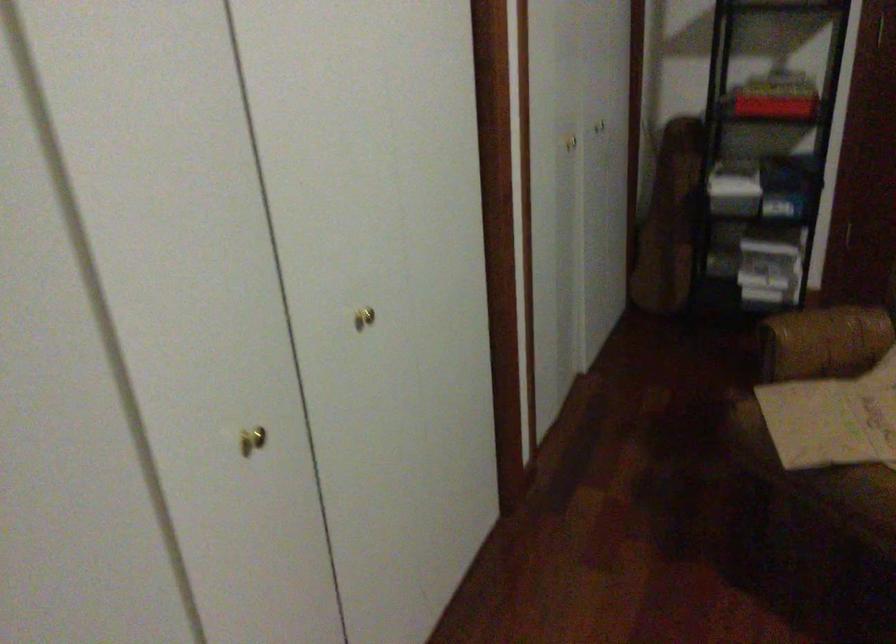
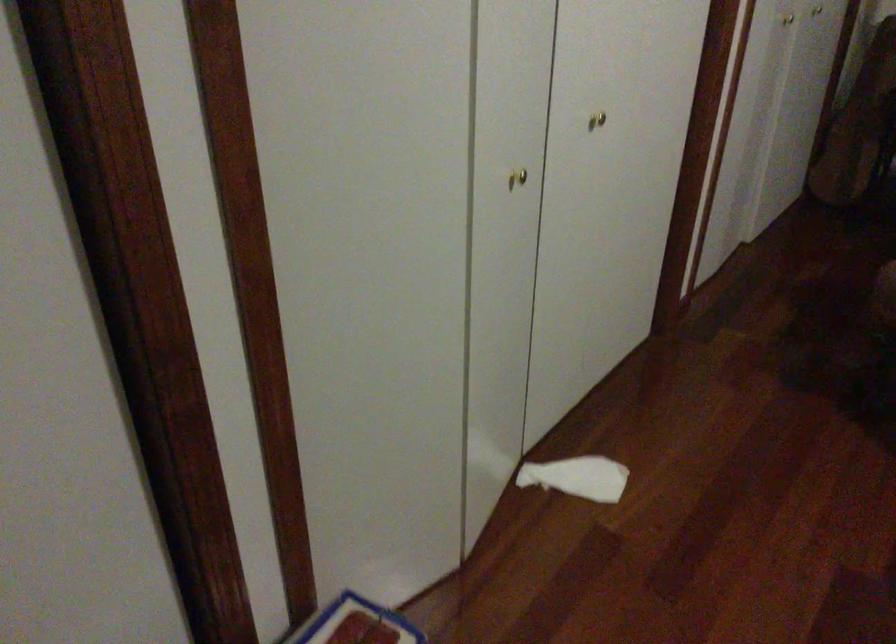
The point at (261,449) is marked in the first image. Where is the corresponding point in the second image?

(517, 178)